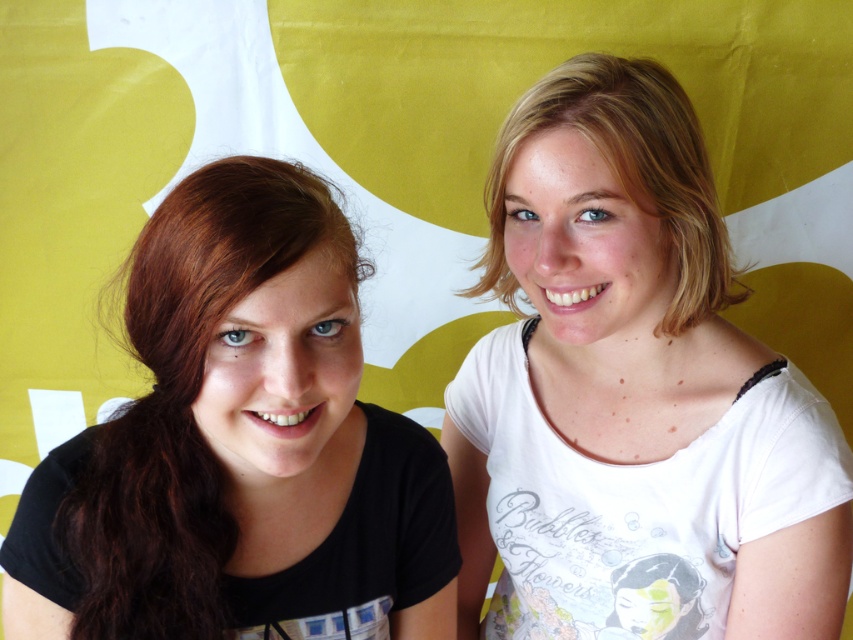
Does point (582, 364) lie behind point (693, 186)?

Yes.

This screenshot has width=853, height=640. I want to click on white cotton t-shirt at upper right, so click(633, 394).

Can you confirm if matte black shirt at left is thinner than matte black hair at left?

No, matte black shirt at left is not thinner than matte black hair at left.

Is matte black shirt at left to the left of matte black hair at left from the viewer's perspective?

Yes, matte black shirt at left is to the left of matte black hair at left.

Between point (318, 616) and point (723, 307), which one is positioned behind?

Point (723, 307)

Locate an element on the screen. matte black shirt at left is located at coordinates pos(239,445).

Does white cotton t-shirt at upper right have a smaller size compared to matte black shirt at left?

Incorrect, white cotton t-shirt at upper right is not smaller in size than matte black shirt at left.

Which is more to the left, white cotton t-shirt at upper right or matte black shirt at left?

matte black shirt at left

Identify the location of white cotton t-shirt at upper right. (633, 394).

Locate an element on the screen. white cotton t-shirt at upper right is located at coordinates (633, 394).